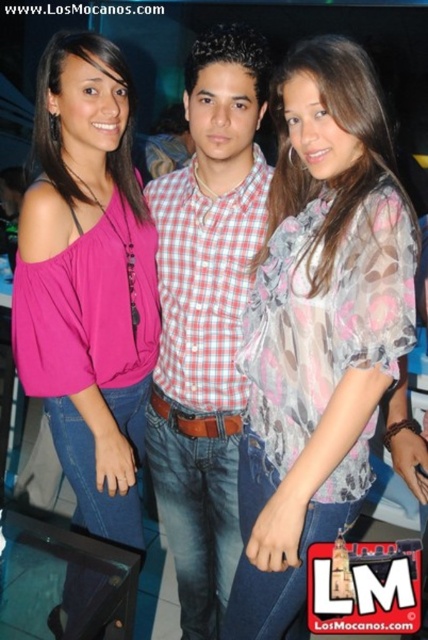
You are at a social event and want to take a photo of both the pink matte top at left and the checkered fabric shirt at center. Since the camera can only focus on one subject at a time, which one should you aim for first to ensure both are in the frame?

You should aim for the checkered fabric shirt at center first because the pink matte top at left is to the left of it, so positioning the camera to include both would require starting from the center and adjusting outward.

You are standing in a dimly lit room with three people. You need to determine which of the two points, point (315, 490) or point (125, 205), is closer to you. Which one is closer?

Point (315, 490) is closer to the viewer than point (125, 205).